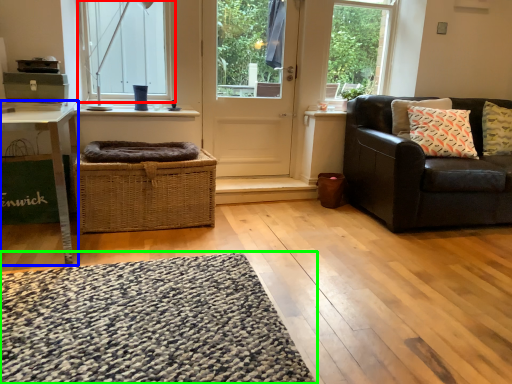
Question: Considering the real-world distances, which object is closest to window (highlighted by a red box)? table (highlighted by a blue box) or mat (highlighted by a green box).

Choices:
 (A) table
 (B) mat

Answer: (A)